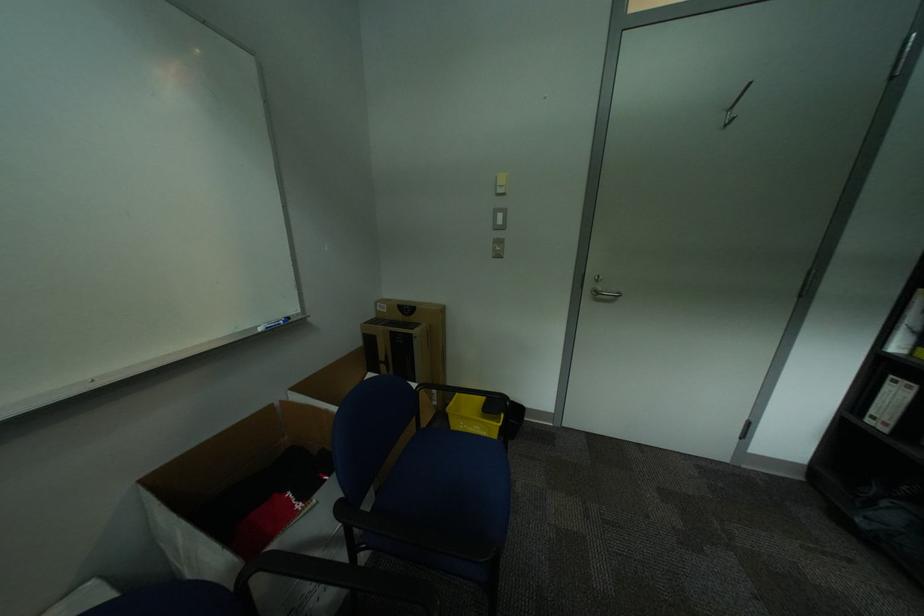
Find where to hang the metal door hook. Please return your answer as a coordinate pair (x, y).

(745, 90)